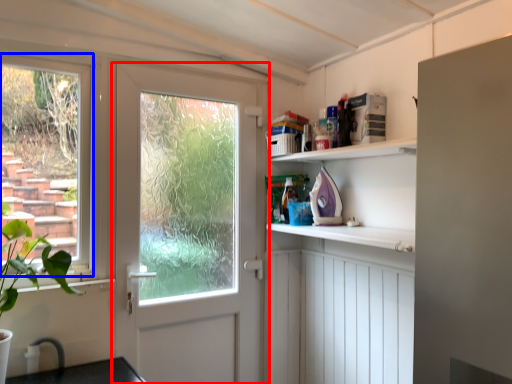
Question: Which object appears farthest to the camera in this image, door (highlighted by a red box) or window (highlighted by a blue box)?

Choices:
 (A) door
 (B) window

Answer: (A)